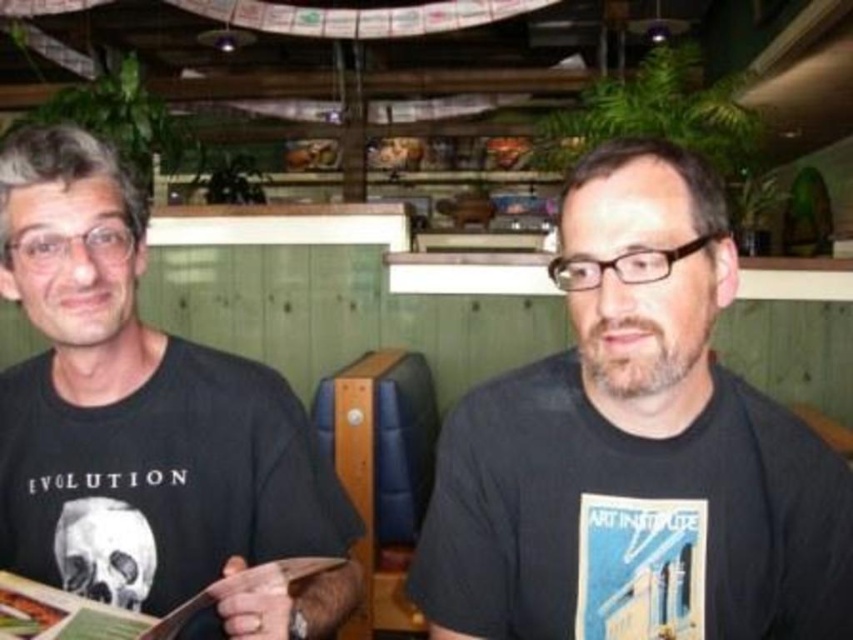
Question: Is black matte t-shirt at center positioned in front of black matte t-shirt at left?

Choices:
 (A) yes
 (B) no

Answer: (A)

Question: Among these objects, which one is nearest to the camera?

Choices:
 (A) black matte t-shirt at left
 (B) black matte t-shirt at center

Answer: (B)

Question: Is black matte t-shirt at center thinner than black matte t-shirt at left?

Choices:
 (A) yes
 (B) no

Answer: (A)

Question: Which of the following is the farthest from the observer?

Choices:
 (A) black matte t-shirt at center
 (B) black matte t-shirt at left

Answer: (B)

Question: Does black matte t-shirt at center have a larger size compared to black matte t-shirt at left?

Choices:
 (A) no
 (B) yes

Answer: (A)